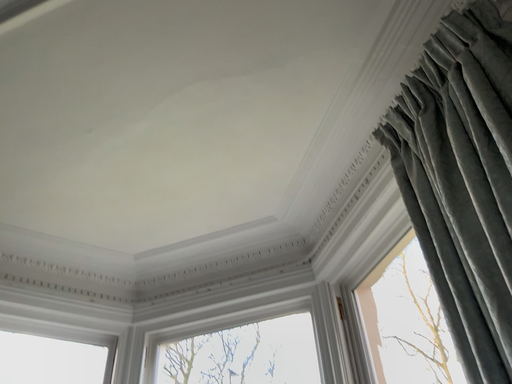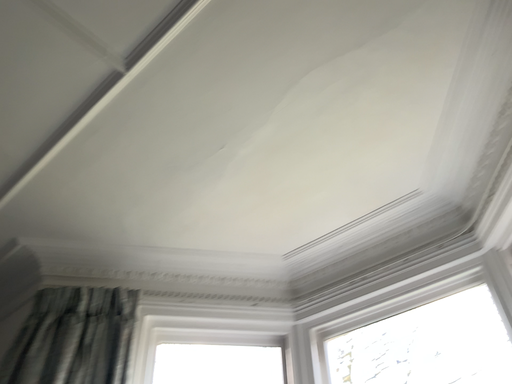
Question: Which way did the camera rotate in the video?

Choices:
 (A) rotated left
 (B) rotated right

Answer: (A)